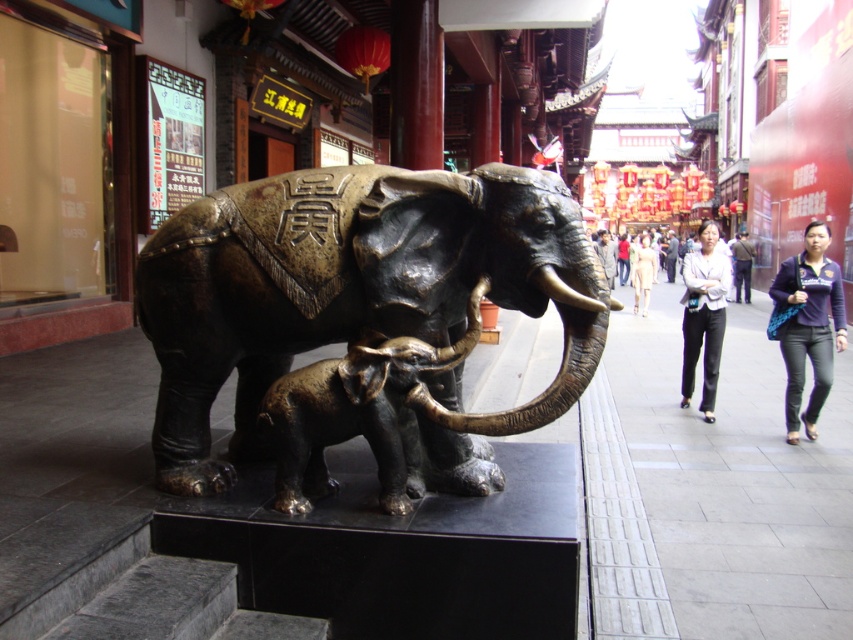
Question: Which is nearer to the gold metallic tusk at center?

Choices:
 (A) bronze elephant at center
 (B) gray concrete pavement at lower right

Answer: (A)

Question: Does bronze elephant at center have a lesser width compared to gold metallic tusk at center?

Choices:
 (A) yes
 (B) no

Answer: (B)

Question: Which is farther from the gray concrete pavement at lower right?

Choices:
 (A) bronze baby elephant at center
 (B) bronze elephant at center

Answer: (B)

Question: Which point is farther to the camera?

Choices:
 (A) gray concrete pavement at lower right
 (B) bronze elephant at center

Answer: (A)

Question: Considering the relative positions of bronze elephant at center and bronze baby elephant at center in the image provided, where is bronze elephant at center located with respect to bronze baby elephant at center?

Choices:
 (A) below
 (B) above

Answer: (B)

Question: Considering the relative positions of bronze baby elephant at center and gold metallic tusk at center in the image provided, where is bronze baby elephant at center located with respect to gold metallic tusk at center?

Choices:
 (A) above
 (B) below

Answer: (B)